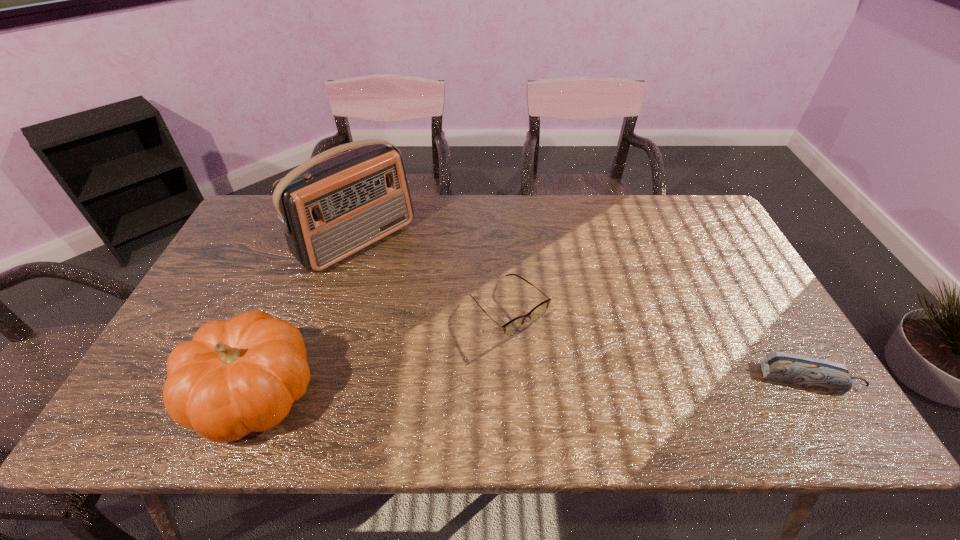
The width and height of the screenshot is (960, 540). Identify the location of vacant space at the near edge. (345, 373).

Find the location of `vacant space at the left edge`. vacant space at the left edge is located at coordinates (240, 255).

In order to click on vacant space at the right edge of the desktop in this screenshot , I will do `click(717, 273)`.

In the image, there is a desktop. Identify the location of free region at the far left corner. (276, 214).

Where is `free space at the far right corner of the desktop`? The height and width of the screenshot is (540, 960). free space at the far right corner of the desktop is located at coordinates (707, 226).

Identify the location of free space between the third shortest object and the second object from right to left. (382, 350).

The image size is (960, 540). I want to click on vacant space that's between the third object from left to right and the second tallest object, so click(x=382, y=350).

The width and height of the screenshot is (960, 540). Identify the location of free point between the spectacles and the rightmost object. (659, 343).

Locate an element on the screen. free spot between the radio receiver and the pumpkin is located at coordinates (306, 317).

Identify the location of unoccupied area between the tallest object and the second tallest object. (306, 317).